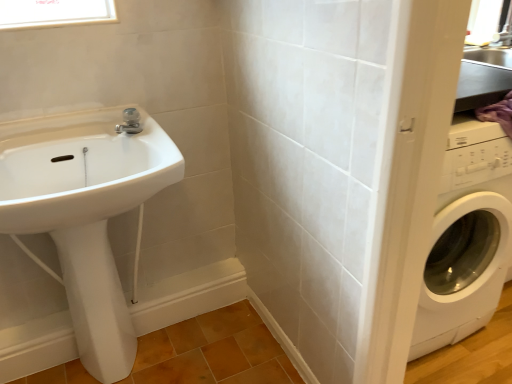
Question: Is white glossy bidet at lower left in front of or behind clear glass window at upper left in the image?

Choices:
 (A) front
 (B) behind

Answer: (A)

Question: Is white glossy bidet at lower left bigger or smaller than clear glass window at upper left?

Choices:
 (A) big
 (B) small

Answer: (A)

Question: Which of these objects is positioned farthest from the white glossy bidet at lower left?

Choices:
 (A) satin nickel faucet at upper center
 (B) clear glass window at upper left
 (C) white glossy sink at left

Answer: (B)

Question: Which object is positioned closest to the satin nickel faucet at upper center?

Choices:
 (A) white glossy sink at left
 (B) white glossy bidet at lower left
 (C) clear glass window at upper left

Answer: (A)